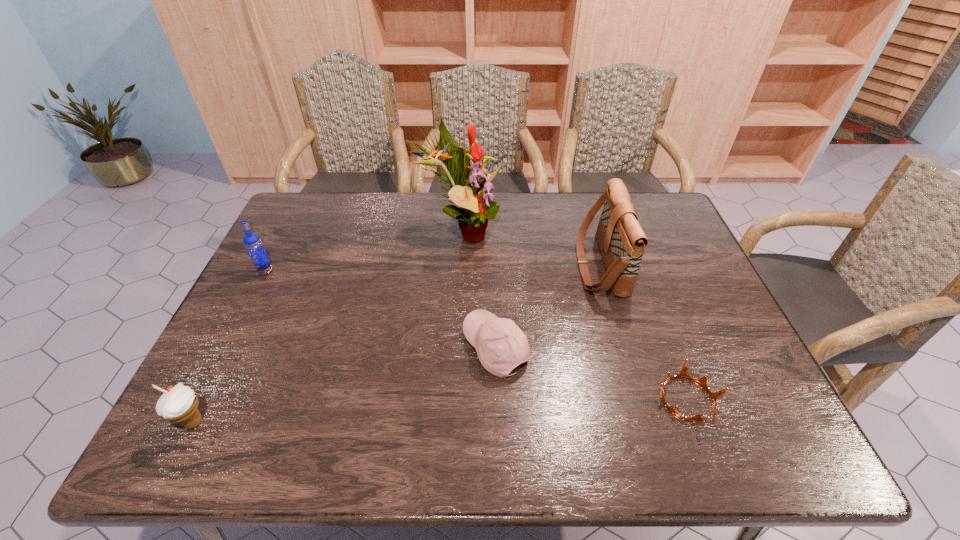
At what (x,y) coordinates should I click in order to perform the action: click on vacant space located 0.350m on the front of the fourth shortest object. Please return your answer as a coordinate pair (x, y). Image resolution: width=960 pixels, height=540 pixels. Looking at the image, I should click on (209, 382).

I want to click on free space located on the back of the icecream, so click(263, 285).

Image resolution: width=960 pixels, height=540 pixels. Identify the location of vacant space situated 0.270m on the front-facing side of the fifth tallest object. [352, 348].

The height and width of the screenshot is (540, 960). Find the location of `free location located on the front-facing side of the fifth tallest object`. free location located on the front-facing side of the fifth tallest object is located at coordinates [348, 348].

The image size is (960, 540). In order to click on vacant area located on the front-facing side of the fifth tallest object in this screenshot , I will do `click(316, 348)`.

The image size is (960, 540). I want to click on vacant area situated 0.280m on the left of the crown, so click(x=529, y=400).

This screenshot has width=960, height=540. I want to click on bouquet located in the far edge section of the desktop, so click(x=477, y=206).

At what (x,y) coordinates should I click in order to perform the action: click on shoulder bag that is at the far edge. Please return your answer as a coordinate pair (x, y). Looking at the image, I should click on (622, 242).

Where is `icecream located at the near edge`? This screenshot has height=540, width=960. icecream located at the near edge is located at coordinates (180, 403).

Locate an element on the screen. This screenshot has width=960, height=540. crown that is positioned at the near edge is located at coordinates (683, 374).